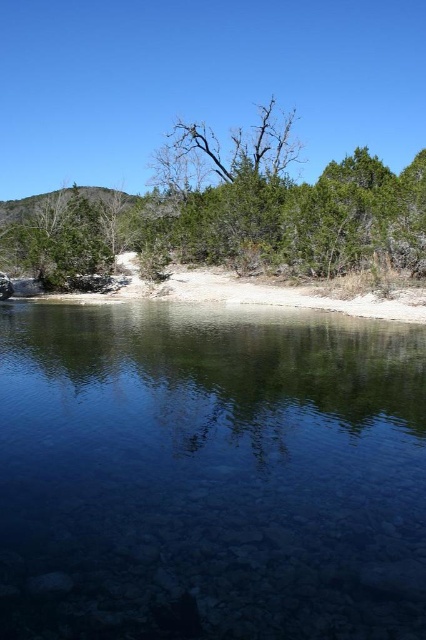
You are standing at the edge of the water and want to place a small floating marker exactly at the center of the clear glassy water at center. According to the coordinates provided, where should you place the marker?

The clear glassy water at center is located at coordinates point (210, 474), so you should place the marker at point (210, 474).

You are standing at the shoreline looking towards the water. There are two points marked in the image. The first is at coordinates point (97, 220) and the second is at point (256, 125). Which of these two points is closer to you?

Point (97, 220) is in front of point (256, 125), so it is closer to you.